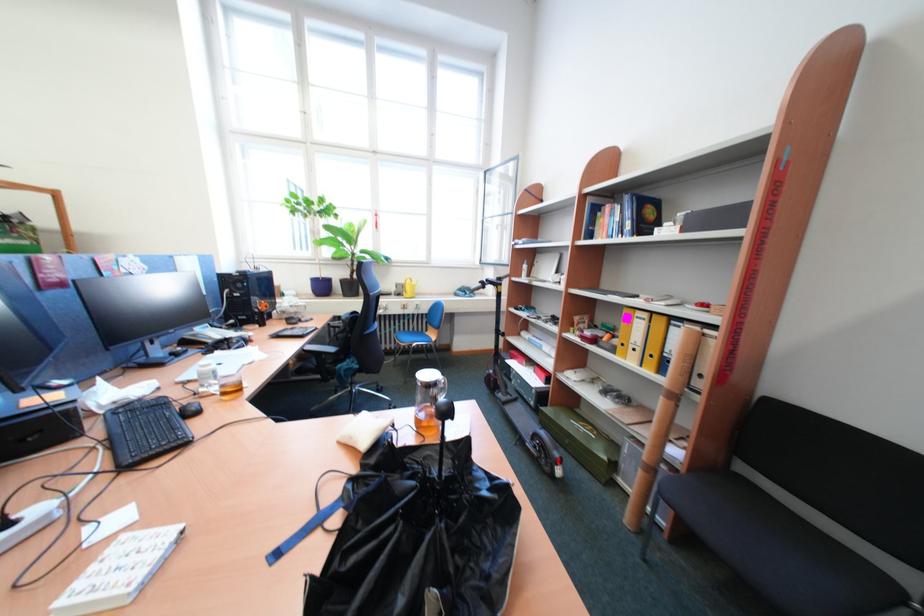
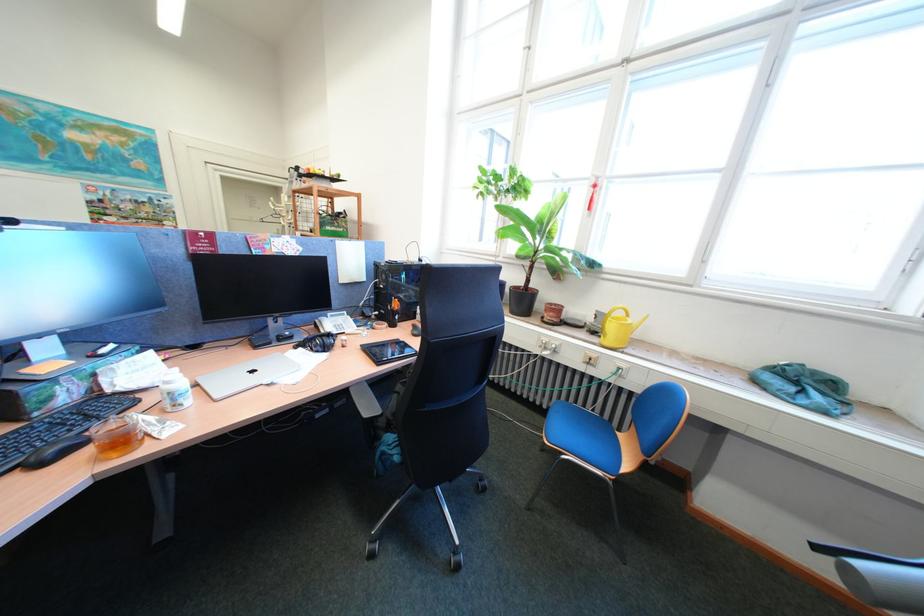
Locate, in the second image, the point that corresponds to (x=407, y=291) in the first image.

(602, 321)